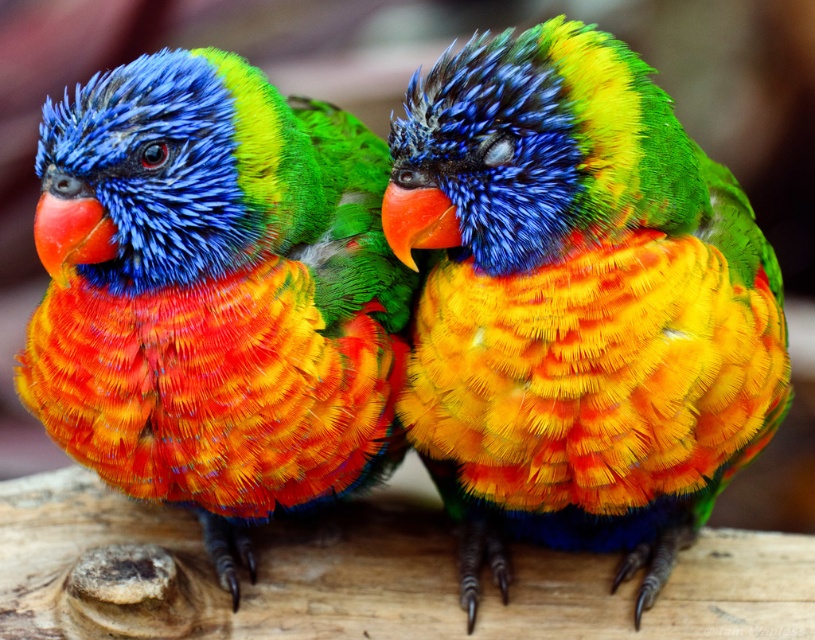
You are a birdwatcher trying to identify two lorikeets in the image. The scene shows a shiny multicolored parrot at center and a shiny multicolored parrot at left. Which one is bigger?

The shiny multicolored parrot at center is larger in size than the shiny multicolored parrot at left.